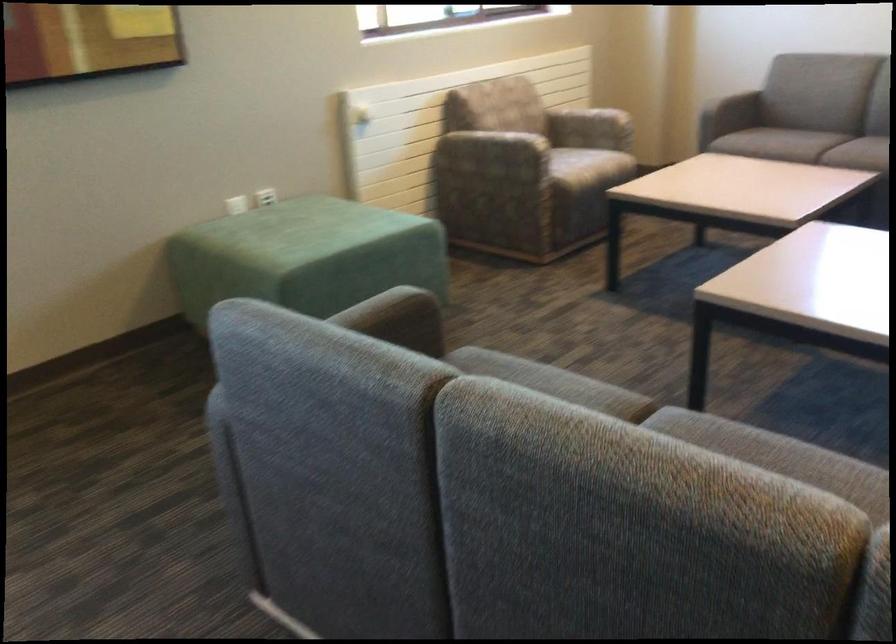
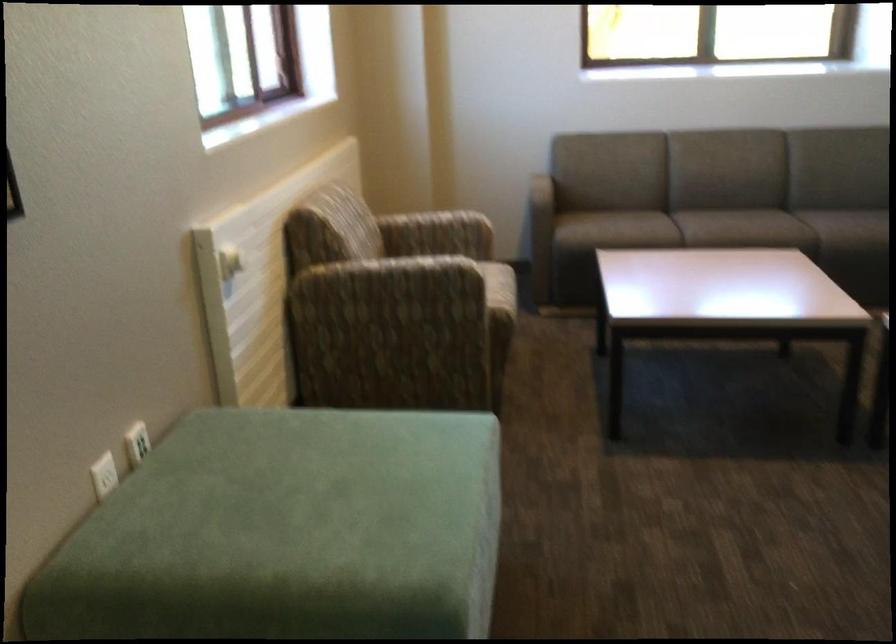
Where in the second image is the point corresponding to pixel 574 122 from the first image?

(436, 234)